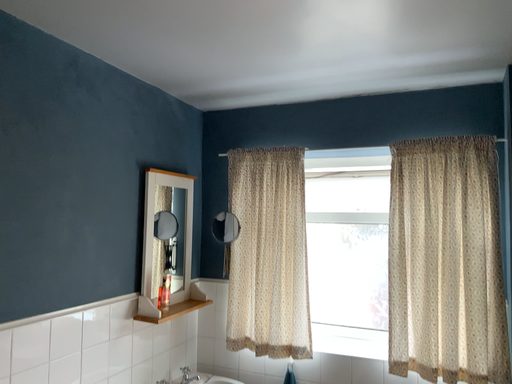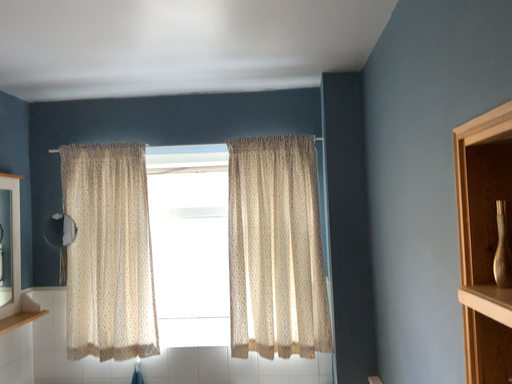
Question: Which way did the camera rotate in the video?

Choices:
 (A) rotated left
 (B) rotated right

Answer: (B)